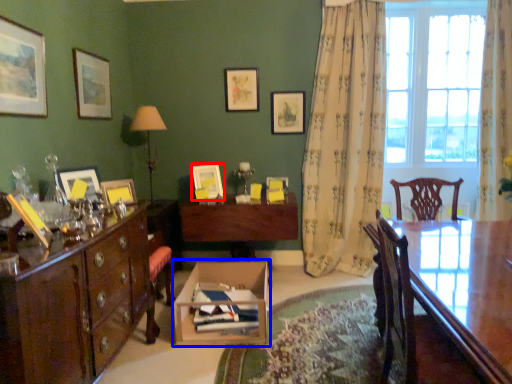
Question: Which object appears farthest to the camera in this image, picture frame (highlighted by a red box) or cardboard box (highlighted by a blue box)?

Choices:
 (A) picture frame
 (B) cardboard box

Answer: (A)